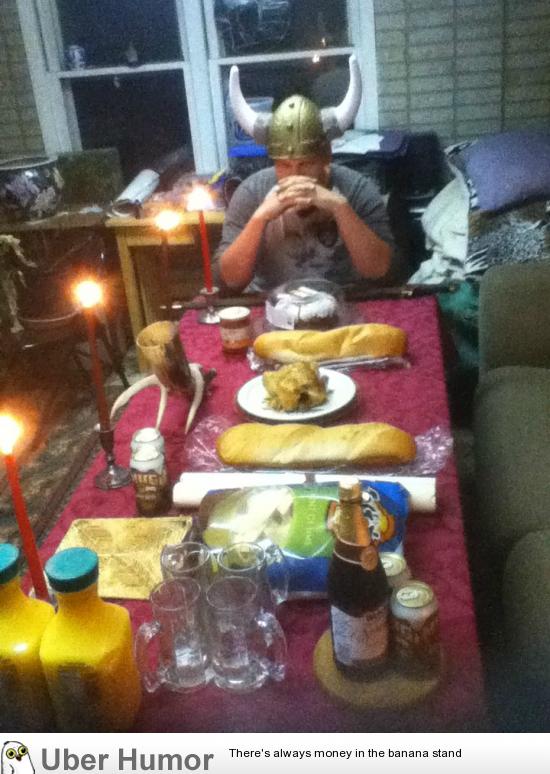
This screenshot has height=774, width=550. I want to click on candles, so click(x=21, y=511), click(x=97, y=370), click(x=205, y=238), click(x=165, y=269).